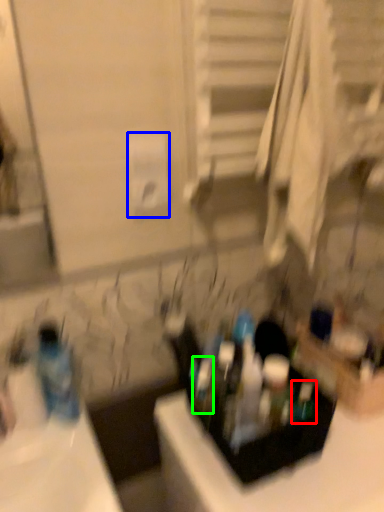
Question: Which object is the farthest from mouthwash (highlighted by a red box)? Choose among these: toilet paper (highlighted by a blue box) or toiletry (highlighted by a green box).

Choices:
 (A) toilet paper
 (B) toiletry

Answer: (A)